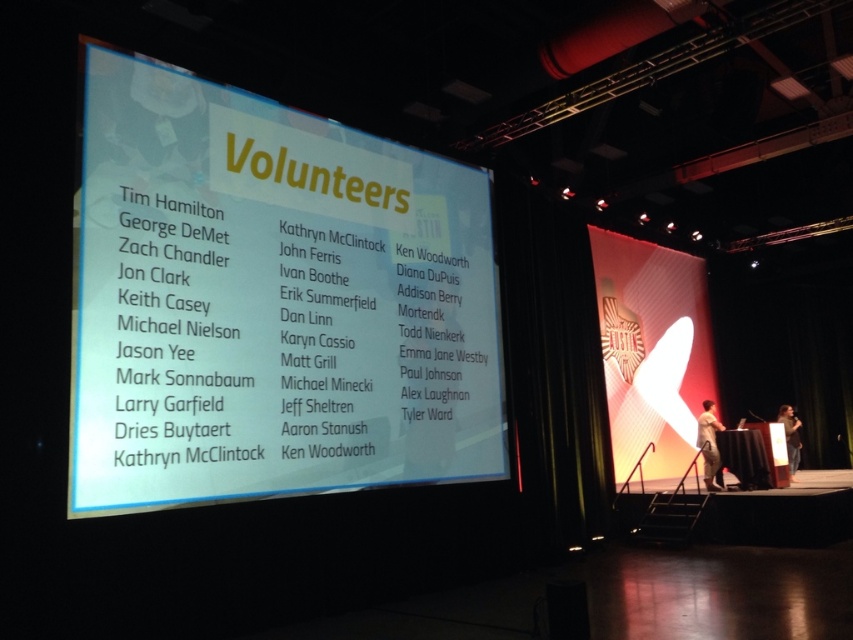
Question: Does white fabric at center appear over light brown fabric shirt at center?

Choices:
 (A) no
 (B) yes

Answer: (B)

Question: Which object appears farthest from the camera in this image?

Choices:
 (A) white fabric at center
 (B) white paper at center

Answer: (A)

Question: Among these objects, which one is farthest from the camera?

Choices:
 (A) light brown fabric shirt at center
 (B) white fabric at center
 (C) white paper at center
 (D) white glossy screen at center

Answer: (A)

Question: Which point appears farthest from the camera in this image?

Choices:
 (A) (717, 488)
 (B) (698, 356)
 (C) (782, 426)
 (D) (136, 141)

Answer: (B)

Question: Where is white paper at center located in relation to white fabric at center in the image?

Choices:
 (A) below
 (B) above

Answer: (B)

Question: Is white glossy screen at center to the right of light brown fabric shirt at center from the viewer's perspective?

Choices:
 (A) no
 (B) yes

Answer: (A)